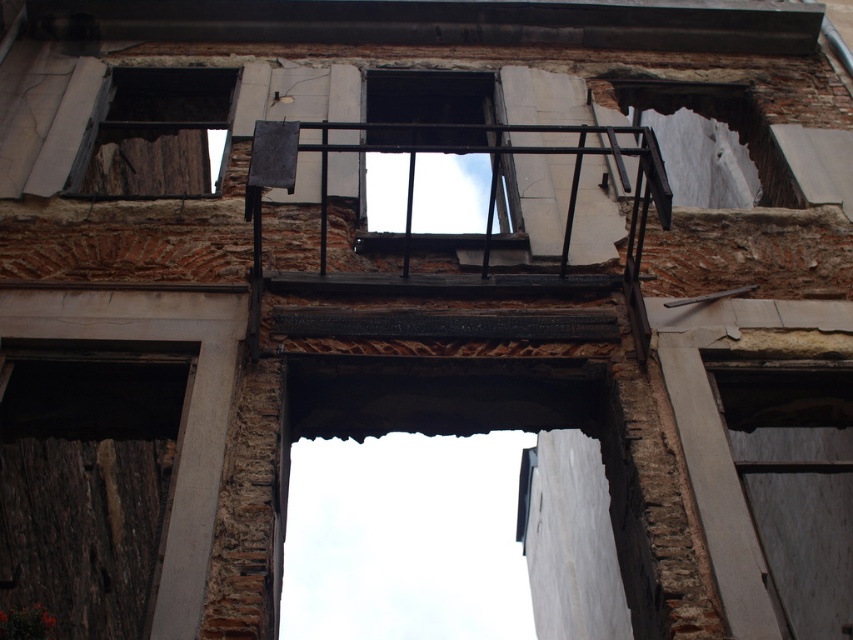
Based on the photo, you are an architect inspecting the building. You notice the smooth white window at lower right and the metallic black balcony at center. Which of these two objects is shorter in height?

The smooth white window at lower right is shorter in height than the metallic black balcony at center because it is not as tall.